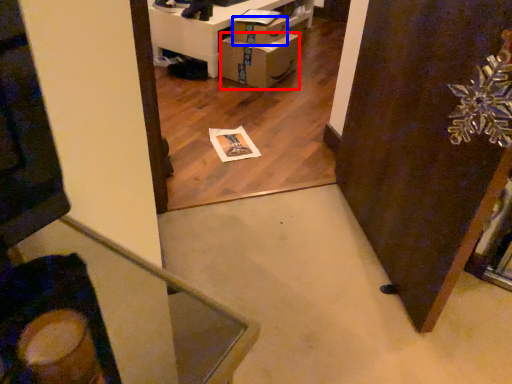
Question: Which point is further to the camera, cardboard box (highlighted by a red box) or drawer (highlighted by a blue box)?

Choices:
 (A) cardboard box
 (B) drawer

Answer: (B)